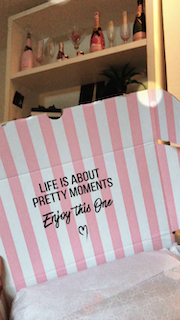
Identify the location of 2 shelves. The width and height of the screenshot is (180, 320). (66, 8), (69, 69).